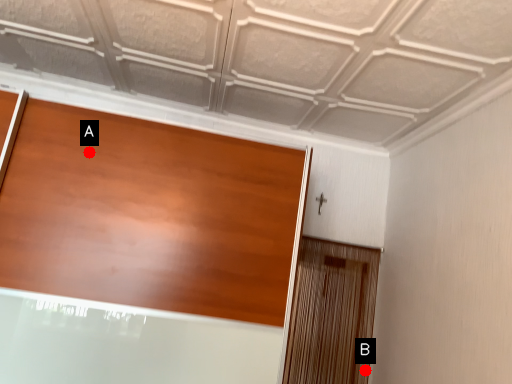
Question: Two points are circled on the image, labeled by A and B beside each circle. Which point is closer to the camera taking this photo?

Choices:
 (A) A is closer
 (B) B is closer

Answer: (A)